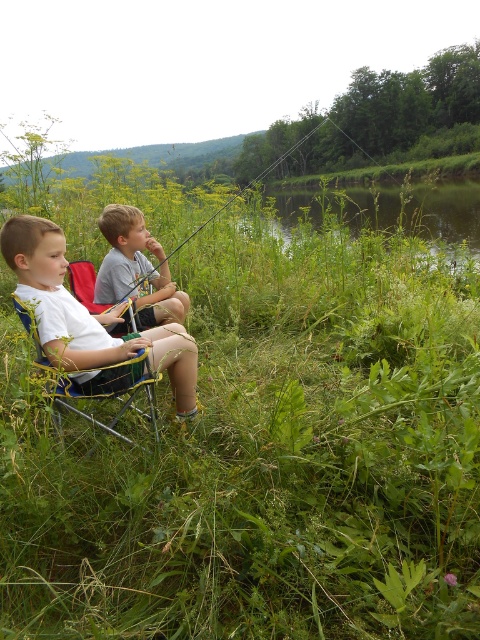
You are a photographer trying to capture a candid shot of the two boys fishing. You need to position your camera between the white fabric shorts at lower left and the yellow fabric chair at center. Given that your camera requires a minimum of 6 inches of space to avoid obstruction, will you have enough room to set it up?

The distance between the white fabric shorts at lower left and the yellow fabric chair at center is 6.68 inches, which is more than the required 6 inches. Therefore, you have enough space to position the camera without obstruction.

You are a photographer trying to capture a closeup of the gray cotton shirt at center and the blue fabric chair at left. Since you want to focus on the shirt, which object should you ensure is closer to the camera lens?

The gray cotton shirt at center has a greater height compared to the blue fabric chair at left, so to focus on the shirt, you should ensure the gray cotton shirt at center is closer to the camera lens.